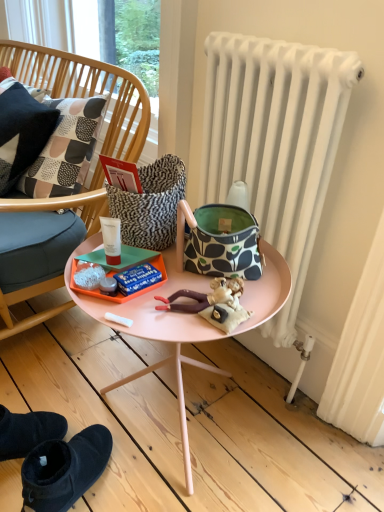
Question: Can patterned fabric handbag at center be found inside wooden chair at left?

Choices:
 (A) yes
 (B) no

Answer: (B)

Question: Considering the relative sizes of wooden chair at left and patterned fabric handbag at center in the image provided, is wooden chair at left bigger than patterned fabric handbag at center?

Choices:
 (A) yes
 (B) no

Answer: (A)

Question: Is wooden chair at left with patterned fabric handbag at center?

Choices:
 (A) no
 (B) yes

Answer: (A)

Question: From a real-world perspective, is wooden chair at left positioned over patterned fabric handbag at center based on gravity?

Choices:
 (A) yes
 (B) no

Answer: (B)

Question: Can you confirm if wooden chair at left is wider than patterned fabric handbag at center?

Choices:
 (A) no
 (B) yes

Answer: (B)

Question: From a real-world perspective, is patterned fabric pillow at left positioned above or below white matte radiator at right?

Choices:
 (A) above
 (B) below

Answer: (A)

Question: From the image's perspective, is patterned fabric pillow at left positioned above or below white matte radiator at right?

Choices:
 (A) below
 (B) above

Answer: (B)

Question: Is point (14, 167) positioned closer to the camera than point (233, 74)?

Choices:
 (A) closer
 (B) farther

Answer: (B)

Question: Relative to white matte radiator at right, is patterned fabric pillow at left in front or behind?

Choices:
 (A) front
 (B) behind

Answer: (B)

Question: Considering the positions of patterned fabric pillow at left and wooden chair at left in the image, is patterned fabric pillow at left taller or shorter than wooden chair at left?

Choices:
 (A) short
 (B) tall

Answer: (A)

Question: Looking at their shapes, would you say patterned fabric pillow at left is wider or thinner than wooden chair at left?

Choices:
 (A) thin
 (B) wide

Answer: (A)

Question: Choose the correct answer: Is patterned fabric pillow at left inside wooden chair at left or outside it?

Choices:
 (A) inside
 (B) outside

Answer: (A)

Question: Is patterned fabric pillow at left in front of or behind wooden chair at left in the image?

Choices:
 (A) behind
 (B) front

Answer: (A)

Question: Is point (21, 96) positioned closer to the camera than point (216, 205)?

Choices:
 (A) closer
 (B) farther

Answer: (B)

Question: Considering the positions of patterned fabric pillow at left and patterned fabric handbag at center in the image, is patterned fabric pillow at left bigger or smaller than patterned fabric handbag at center?

Choices:
 (A) big
 (B) small

Answer: (A)